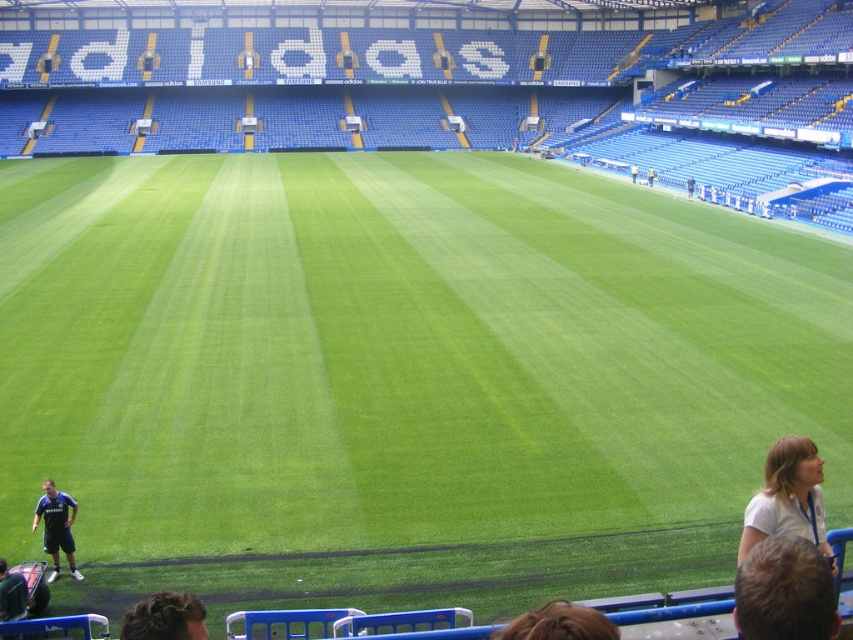
Looking at this image, you are a photographer standing at the edge of the football pitch. You want to take a photo that includes both the brown hair at lower center and the blue jersey at lower left. Which object should you adjust your camera focus to first to ensure both are in the frame?

The brown hair at lower center is closer to the viewer than the blue jersey at lower left, so you should adjust your camera focus to the brown hair at lower center first to ensure both are in the frame.

You are a photographer standing at the edge of the football pitch. You need to capture a photo where both the brown hair at lower center and the blue jersey at lower left are visible. Which object should you focus on first to ensure both are in frame?

You should focus on the blue jersey at lower left first because its width is larger than the brown hair at lower center, making it easier to frame both objects by starting with the wider one.

You are standing at the edge of the football pitch in the stadium. There is a point marked at coordinates point (808, 499). Can you reach this point without moving more than 20 feet from where you are standing?

The point (808, 499) is 18.41 feet away from the viewer, so yes, you can reach it without moving more than 20 feet.